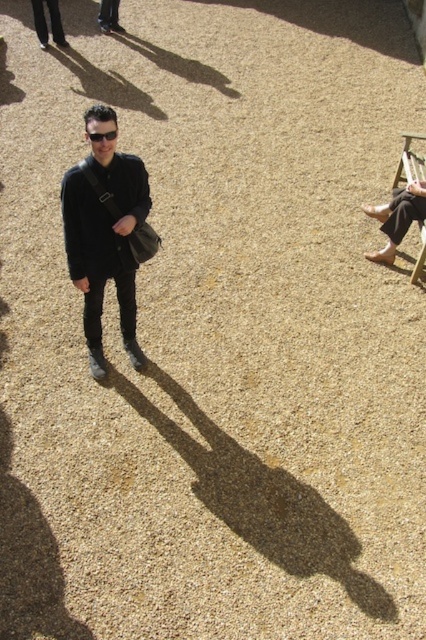
Can you confirm if wooden at right is positioned to the left of black matte sunglasses at center?

In fact, wooden at right is to the right of black matte sunglasses at center.

Which is more to the left, wooden at right or black matte sunglasses at center?

black matte sunglasses at center

Is point (394, 182) closer to camera compared to point (91, 132)?

No.

The height and width of the screenshot is (640, 426). I want to click on wooden at right, so click(x=409, y=161).

Is point (135, 344) less distant than point (417, 262)?

Yes, it is in front of point (417, 262).

Does matte black jacket at center have a lesser width compared to wooden at right?

In fact, matte black jacket at center might be wider than wooden at right.

Does point (131, 170) come closer to viewer compared to point (406, 138)?

Yes, it is.

This screenshot has height=640, width=426. In order to click on matte black jacket at center in this screenshot , I will do `click(108, 241)`.

Does point (141, 248) come farther from viewer compared to point (108, 131)?

Yes, it is.

Does point (134, 208) come farther from viewer compared to point (98, 136)?

Yes, it is.

What are the coordinates of `matte black jacket at center` in the screenshot? It's located at (108, 241).